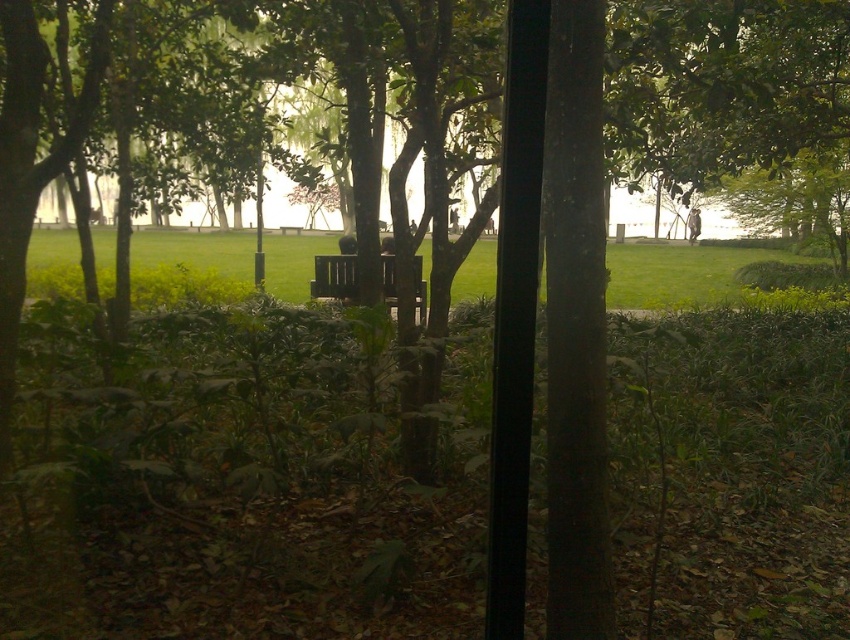
Question: Observing the image, what is the correct spatial positioning of green grassy at center in reference to wooden bench at center?

Choices:
 (A) above
 (B) below

Answer: (A)

Question: Which of the following is the closest to the observer?

Choices:
 (A) green grassy at center
 (B) wooden bench at center

Answer: (A)

Question: Which point is closer to the camera taking this photo?

Choices:
 (A) (622, 304)
 (B) (326, 276)

Answer: (B)

Question: Which object appears farthest from the camera in this image?

Choices:
 (A) wooden bench at center
 (B) green grassy at center

Answer: (A)

Question: Does green grassy at center appear on the right side of wooden bench at center?

Choices:
 (A) no
 (B) yes

Answer: (B)

Question: Is green grassy at center behind wooden bench at center?

Choices:
 (A) no
 (B) yes

Answer: (A)